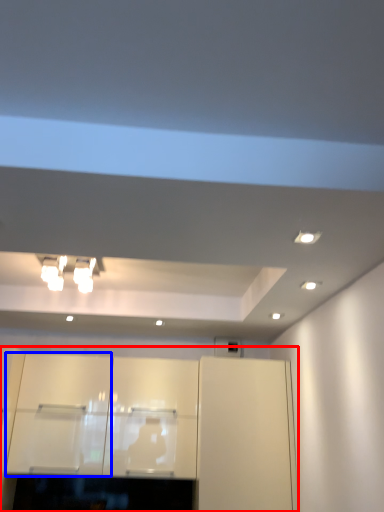
Question: Which of the following is the closest to the observer, cabinetry (highlighted by a red box) or cabinetry (highlighted by a blue box)?

Choices:
 (A) cabinetry
 (B) cabinetry

Answer: (A)